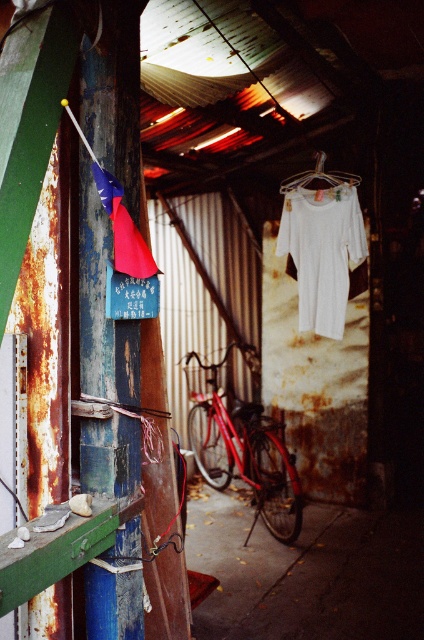
Can you confirm if white cotton pants at center is positioned above white fabric at center?

No.

Does white cotton pants at center appear on the left side of white fabric at center?

Incorrect, white cotton pants at center is not on the left side of white fabric at center.

Is point (362, 241) farther from viewer compared to point (306, 172)?

No.

Identify the location of white cotton pants at center. This screenshot has height=640, width=424. (323, 252).

Does rusty wood pole at left appear on the right side of white fabric at center?

In fact, rusty wood pole at left is to the left of white fabric at center.

Between point (117, 541) and point (339, 180), which one is positioned behind?

Positioned behind is point (339, 180).

Where is `rusty wood pole at left`? This screenshot has height=640, width=424. rusty wood pole at left is located at coordinates (114, 93).

Which is more to the left, rusty wood pole at left or white cotton pants at center?

rusty wood pole at left is more to the left.

The height and width of the screenshot is (640, 424). What are the coordinates of `rusty wood pole at left` in the screenshot? It's located at (114, 93).

Which is behind, point (97, 385) or point (337, 252)?

The point (337, 252) is more distant.

Locate an element on the screen. rusty wood pole at left is located at coordinates (114, 93).